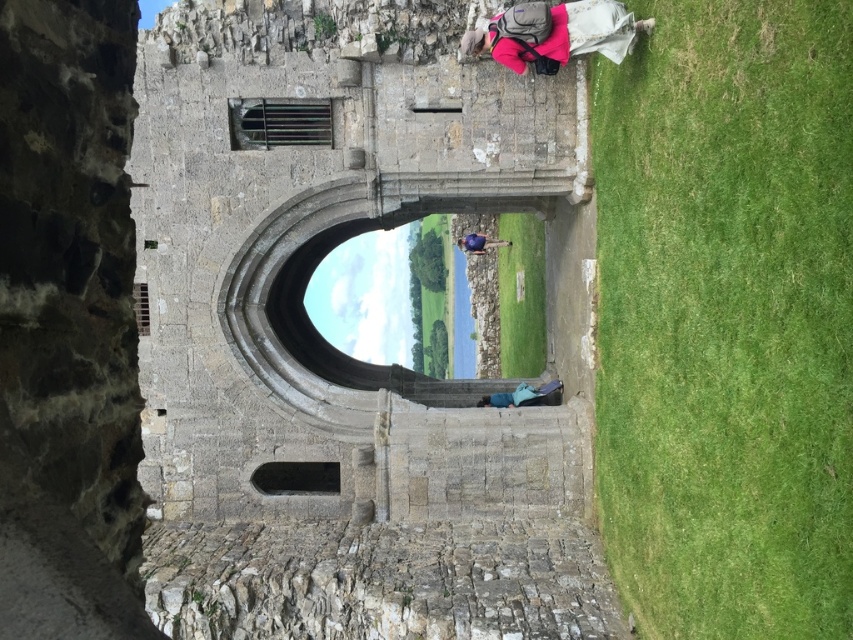
Is pink fabric backpack at upper right further to the viewer compared to blue fabric at center?

No, it is in front of blue fabric at center.

Is pink fabric backpack at upper right to the right of blue fabric at center from the viewer's perspective?

In fact, pink fabric backpack at upper right is to the left of blue fabric at center.

This screenshot has width=853, height=640. I want to click on pink fabric backpack at upper right, so click(x=590, y=29).

Is blue fabric bag at lower center bigger than blue fabric at center?

No, blue fabric bag at lower center is not bigger than blue fabric at center.

Is blue fabric bag at lower center wider than blue fabric at center?

Correct, the width of blue fabric bag at lower center exceeds that of blue fabric at center.

You are a GUI agent. You are given a task and a screenshot of the screen. Output one action in this format:
    pyautogui.click(x=<x>, y=<y>)
    Task: Click on the blue fabric bag at lower center
    The height and width of the screenshot is (640, 853).
    Given the screenshot: What is the action you would take?
    pyautogui.click(x=520, y=394)

Locate an element on the screen. blue fabric bag at lower center is located at coordinates (520, 394).

Between point (543, 42) and point (531, 390), which one is positioned in front?

Point (543, 42) is more forward.

Is pink fabric backpack at upper right positioned at the back of blue fabric bag at lower center?

No, it is not.

Is point (606, 4) positioned before point (537, 396)?

Yes.

Identify the location of pink fabric backpack at upper right. The image size is (853, 640). (590, 29).